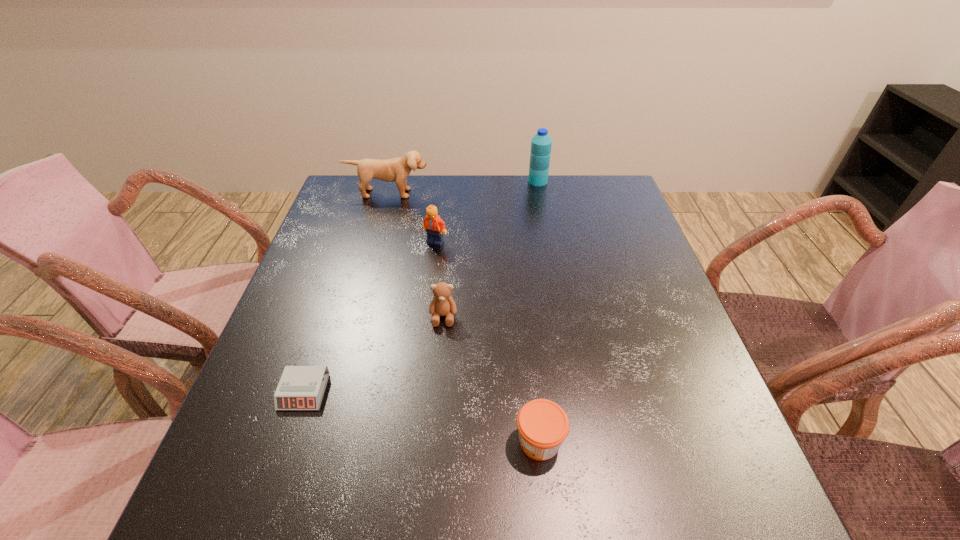
Locate an element on the screen. This screenshot has width=960, height=540. water bottle located in the far edge section of the desktop is located at coordinates (541, 143).

This screenshot has width=960, height=540. I want to click on puppy positioned at the far edge, so click(x=397, y=170).

This screenshot has width=960, height=540. Find the location of `puppy present at the left edge`. puppy present at the left edge is located at coordinates (397, 170).

In order to click on alarm clock that is at the left edge in this screenshot , I will do `click(301, 387)`.

The height and width of the screenshot is (540, 960). I want to click on object located in the far left corner section of the desktop, so (x=397, y=170).

Where is `free spot at the far edge of the desktop`? The image size is (960, 540). free spot at the far edge of the desktop is located at coordinates (413, 197).

The height and width of the screenshot is (540, 960). Find the location of `vacant space at the near edge of the desktop`. vacant space at the near edge of the desktop is located at coordinates (425, 517).

Where is `free space at the left edge`? This screenshot has width=960, height=540. free space at the left edge is located at coordinates (322, 262).

At what (x,y) coordinates should I click in order to perform the action: click on vacant space at the right edge of the desktop. Please return your answer as a coordinate pair (x, y). The height and width of the screenshot is (540, 960). Looking at the image, I should click on (670, 373).

Where is `blank space at the far left corner of the desktop`? blank space at the far left corner of the desktop is located at coordinates (341, 209).